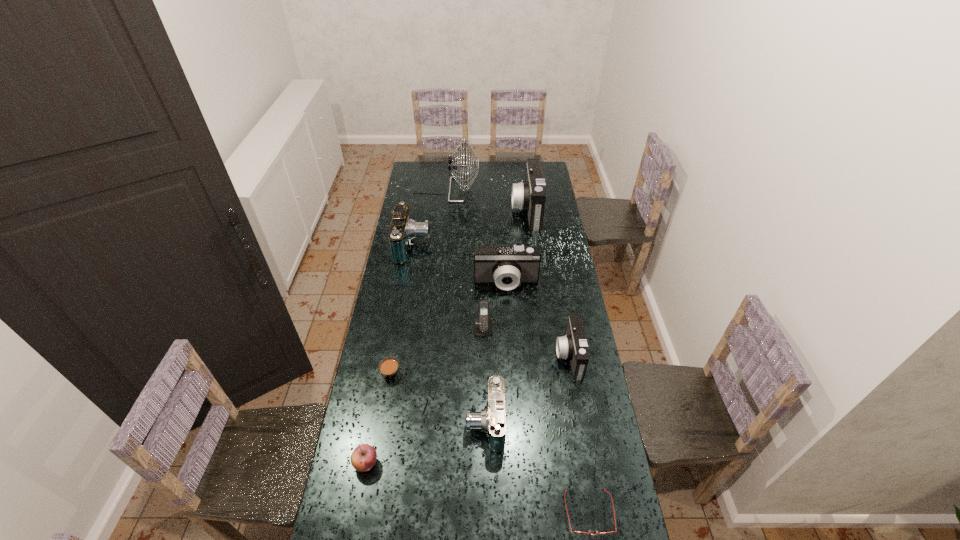
Image resolution: width=960 pixels, height=540 pixels. In the image, there is a desktop. Identify the location of free region at the left edge. (420, 192).

At what (x,y) coordinates should I click in order to perform the action: click on free space at the right edge of the desktop. Please return your answer as a coordinate pair (x, y). This screenshot has width=960, height=540. Looking at the image, I should click on (560, 259).

Locate an element on the screen. vacant space in between the spectacles and the tallest object is located at coordinates (517, 352).

This screenshot has height=540, width=960. I want to click on vacant region between the tallest object and the ninth tallest object, so pyautogui.click(x=419, y=282).

The height and width of the screenshot is (540, 960). I want to click on empty space that is in between the second farthest black camcorder and the ninth tallest object, so click(448, 328).

Find the location of a particular element. unoccupied position between the left blue camcorder and the second shortest object is located at coordinates (402, 309).

Find the location of a particular element. This screenshot has width=960, height=540. free space that is in between the eighth tallest object and the bigger blue camcorder is located at coordinates (390, 355).

Image resolution: width=960 pixels, height=540 pixels. I want to click on unoccupied position between the tallest object and the apple, so click(406, 327).

Image resolution: width=960 pixels, height=540 pixels. I want to click on free spot between the fourth farthest object and the second nearest camcorder, so click(538, 320).

Find the location of `free space that is in between the eighth tallest object and the smaller blue camcorder`. free space that is in between the eighth tallest object and the smaller blue camcorder is located at coordinates (425, 443).